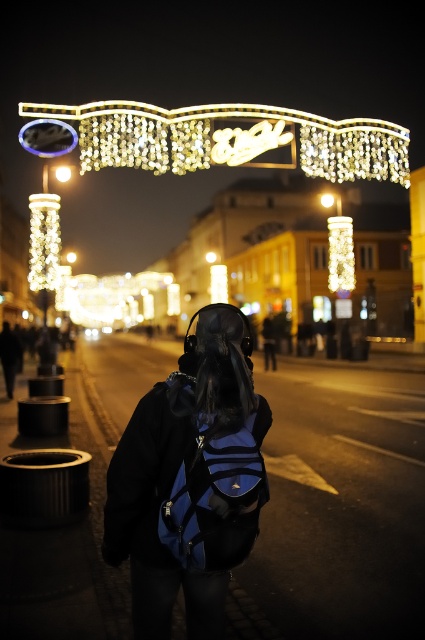
Question: Can you confirm if blue fabric backpack at center is positioned to the left of illuminated glass column at left?

Choices:
 (A) no
 (B) yes

Answer: (A)

Question: From the image, what is the correct spatial relationship of blue fabric backpack at center in relation to illuminated glass column at left?

Choices:
 (A) left
 (B) right

Answer: (B)

Question: Which point is farther to the camera?

Choices:
 (A) matte gold light at center
 (B) matte white light at center
 (C) bright yellow light at center
 (D) illuminated glass column at left

Answer: (C)

Question: Can you confirm if iridescent glass arch at upper center is wider than matte white light at center?

Choices:
 (A) yes
 (B) no

Answer: (A)

Question: Which object appears closest to the camera in this image?

Choices:
 (A) blue fabric backpack at center
 (B) illuminated glass column at left
 (C) bright yellow light at center
 (D) iridescent glass arch at upper center

Answer: (A)

Question: Which of these objects is positioned closest to the iridescent glass arch at upper center?

Choices:
 (A) blue fabric backpack at center
 (B) illuminated glass column at left
 (C) matte white light at center

Answer: (B)